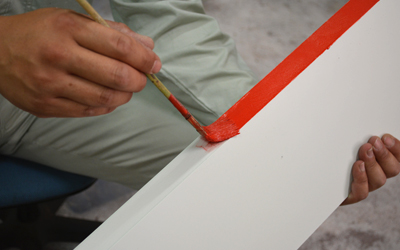
Locate an element on the screen. Image resolution: width=400 pixels, height=250 pixels. white board is located at coordinates (299, 167).